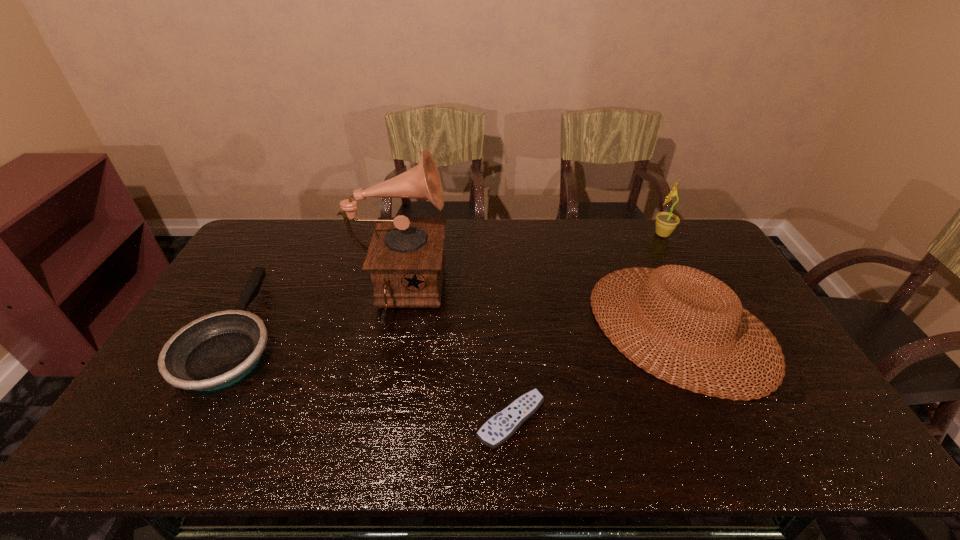
What are the coordinates of `free point that satisfies the following two spatial constraints: 1. on the horn of the third object from right to left; 2. on the left side of the tallest object` in the screenshot? It's located at tap(372, 419).

Locate an element on the screen. free space that satisfies the following two spatial constraints: 1. on the horn of the shortest object; 2. on the right side of the fourth object from right to left is located at coordinates (372, 419).